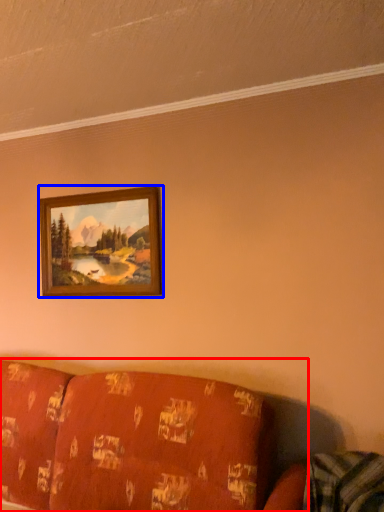
Question: Which point is closer to the camera, studio couch (highlighted by a red box) or picture frame (highlighted by a blue box)?

Choices:
 (A) studio couch
 (B) picture frame

Answer: (A)